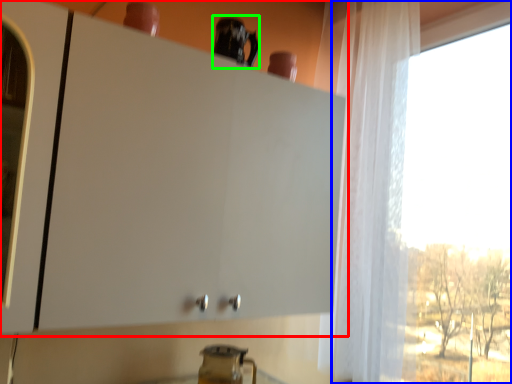
Question: Considering the real-world distances, which object is farthest from cabinetry (highlighted by a red box)? window (highlighted by a blue box) or appliance (highlighted by a green box)?

Choices:
 (A) window
 (B) appliance

Answer: (A)